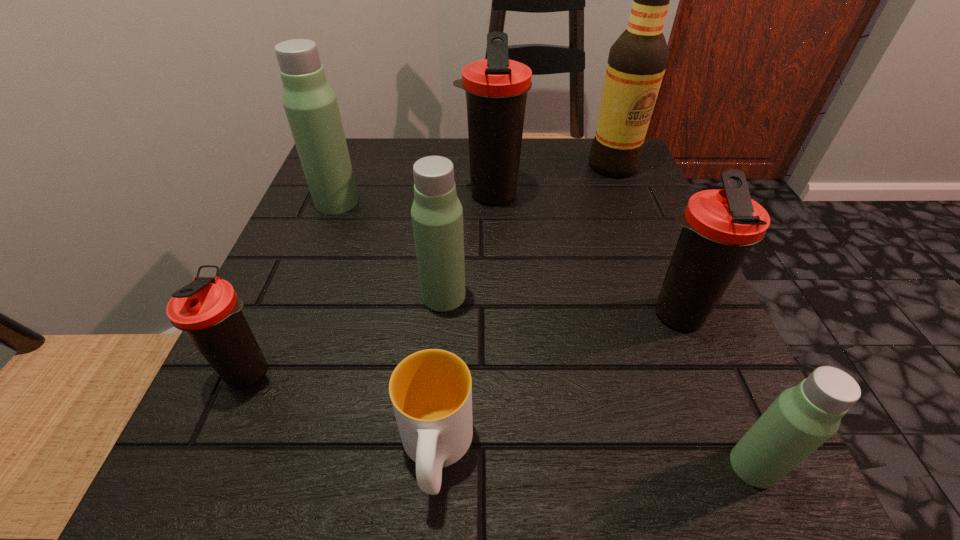
Identify the location of free space between the nearest thermos bottle and the second nearest light thermos bottle. (599, 381).

Identify the location of vacant area that lies between the leftmost brown thermos bottle and the shortest object. This screenshot has height=540, width=960. (343, 411).

Find the location of `free area in between the second brown thermos bottle from left to right and the rightmost brown thermos bottle`. free area in between the second brown thermos bottle from left to right and the rightmost brown thermos bottle is located at coordinates (584, 255).

You are a GUI agent. You are given a task and a screenshot of the screen. Output one action in this format:
    pyautogui.click(x=<x>, y=<y>)
    Task: Click on the free spot between the second farthest brown thermos bottle and the beige alcohol
    The width and height of the screenshot is (960, 540).
    Given the screenshot: What is the action you would take?
    pyautogui.click(x=645, y=240)

Locate an element on the screen. The height and width of the screenshot is (540, 960). blank region between the second farthest brown thermos bottle and the nearest thermos bottle is located at coordinates (715, 390).

Where is `the closest object to the cup`? This screenshot has width=960, height=540. the closest object to the cup is located at coordinates (437, 215).

The image size is (960, 540). Identify the location of object that stands as the closest to the leftmost brown thermos bottle. (431, 390).

I want to click on the sixth closest thermos bottle to the yellow cup, so click(310, 104).

Identify which thermos bottle is the second nearest to the yellow cup. Please provide its 2D coordinates. Your answer should be formatted as a tuple, i.e. [(x, y)], where the tuple contains the x and y coordinates of a point satisfying the conditions above.

[(208, 310)]

You are a GUI agent. You are given a task and a screenshot of the screen. Output one action in this format:
    pyautogui.click(x=<x>, y=<y>)
    Task: Click on the brown thermos bottle that is the third closest to the second light thermos bottle from left to right
    The width and height of the screenshot is (960, 540).
    Given the screenshot: What is the action you would take?
    pyautogui.click(x=719, y=227)